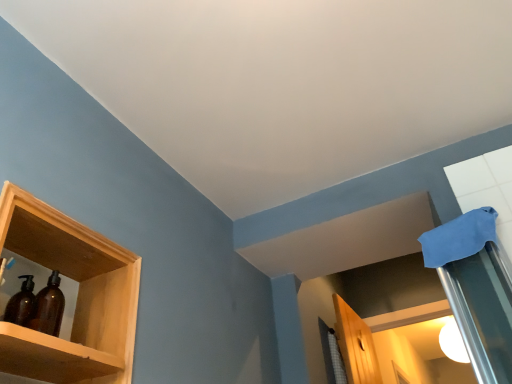
Question: Does amber glass bottles at left have a greater width compared to wooden shelf at left?

Choices:
 (A) no
 (B) yes

Answer: (A)

Question: Considering the relative positions of amber glass bottles at left and wooden shelf at left in the image provided, is amber glass bottles at left to the left of wooden shelf at left from the viewer's perspective?

Choices:
 (A) yes
 (B) no

Answer: (B)

Question: From the image's perspective, is amber glass bottles at left located above wooden shelf at left?

Choices:
 (A) yes
 (B) no

Answer: (A)

Question: Is amber glass bottles at left oriented towards wooden shelf at left?

Choices:
 (A) no
 (B) yes

Answer: (B)

Question: Considering the relative sizes of amber glass bottles at left and wooden shelf at left in the image provided, is amber glass bottles at left smaller than wooden shelf at left?

Choices:
 (A) yes
 (B) no

Answer: (A)

Question: Does amber glass bottles at left have a greater height compared to wooden shelf at left?

Choices:
 (A) no
 (B) yes

Answer: (A)

Question: Is wooden shelf at left located within white glossy light bulb at upper right?

Choices:
 (A) yes
 (B) no

Answer: (B)

Question: From the image's perspective, is white glossy light bulb at upper right located beneath wooden shelf at left?

Choices:
 (A) yes
 (B) no

Answer: (A)

Question: Considering the relative sizes of white glossy light bulb at upper right and wooden shelf at left in the image provided, is white glossy light bulb at upper right wider than wooden shelf at left?

Choices:
 (A) yes
 (B) no

Answer: (A)

Question: Considering the relative sizes of white glossy light bulb at upper right and wooden shelf at left in the image provided, is white glossy light bulb at upper right bigger than wooden shelf at left?

Choices:
 (A) yes
 (B) no

Answer: (B)

Question: Is white glossy light bulb at upper right oriented away from wooden shelf at left?

Choices:
 (A) no
 (B) yes

Answer: (A)

Question: Is white glossy light bulb at upper right placed right next to wooden shelf at left?

Choices:
 (A) no
 (B) yes

Answer: (A)

Question: Is the position of wooden shelf at left more distant than that of amber glass bottles at left?

Choices:
 (A) yes
 (B) no

Answer: (B)